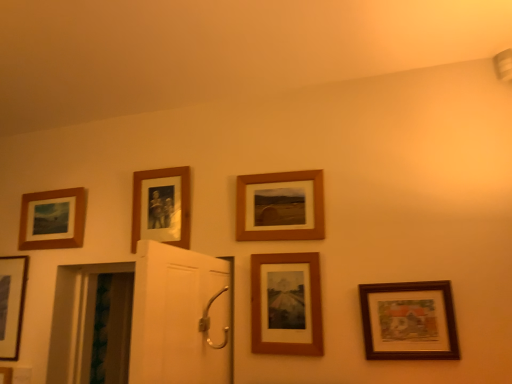
The image size is (512, 384). Describe the element at coordinates (280, 206) in the screenshot. I see `wooden frame at center, the 3th picture frame when ordered from right to left` at that location.

Find the location of a particular element. The height and width of the screenshot is (384, 512). wooden frame at center, the fourth picture frame in the left-to-right sequence is located at coordinates (280, 206).

Describe the element at coordinates (53, 219) in the screenshot. I see `matte wood picture frame at upper left, which is counted as the fifth picture frame, starting from the right` at that location.

Measure the distance between wooden photo frame at upper center, which ranks as the third picture frame in left-to-right order, and camera.

The distance of wooden photo frame at upper center, which ranks as the third picture frame in left-to-right order, from camera is 1.76 meters.

At what (x,y) coordinates should I click in order to perform the action: click on wooden picture frame at lower right, acting as the 1th picture frame starting from the right. Please return your answer as a coordinate pair (x, y). Looking at the image, I should click on (409, 321).

Is wooden picture frame at lower right, positioned as the sixth picture frame in left-to-right order, next to matte black picture frame at lower left, the 6th picture frame positioned from the right?

No, wooden picture frame at lower right, positioned as the sixth picture frame in left-to-right order, is not beside matte black picture frame at lower left, the 6th picture frame positioned from the right.

Considering the relative sizes of wooden picture frame at lower right, acting as the 1th picture frame starting from the right, and matte black picture frame at lower left, the 6th picture frame positioned from the right, in the image provided, is wooden picture frame at lower right, acting as the 1th picture frame starting from the right, thinner than matte black picture frame at lower left, the 6th picture frame positioned from the right,?

Incorrect, the width of wooden picture frame at lower right, acting as the 1th picture frame starting from the right, is not less than that of matte black picture frame at lower left, the 6th picture frame positioned from the right.

Does wooden picture frame at lower right, acting as the 1th picture frame starting from the right, contain matte black picture frame at lower left, the 1th picture frame from the left?

No, matte black picture frame at lower left, the 1th picture frame from the left, is located outside of wooden picture frame at lower right, acting as the 1th picture frame starting from the right.

From the image's perspective, is wooden picture frame at lower right, acting as the 1th picture frame starting from the right, positioned above or below matte black picture frame at lower left, the 1th picture frame from the left?

wooden picture frame at lower right, acting as the 1th picture frame starting from the right, is above matte black picture frame at lower left, the 1th picture frame from the left.

Is matte black picture frame at lower left, the 6th picture frame positioned from the right, at the left side of wooden framed print at center, placed as the second picture frame when sorted from right to left?

Correct, you'll find matte black picture frame at lower left, the 6th picture frame positioned from the right, to the left of wooden framed print at center, placed as the second picture frame when sorted from right to left.

Does matte black picture frame at lower left, the 1th picture frame from the left, have a smaller size compared to wooden framed print at center, placed as the second picture frame when sorted from right to left?

No, matte black picture frame at lower left, the 1th picture frame from the left, is not smaller than wooden framed print at center, placed as the second picture frame when sorted from right to left.

Is matte black picture frame at lower left, the 6th picture frame positioned from the right, in front of or behind wooden framed print at center, placed as the second picture frame when sorted from right to left, in the image?

Clearly, matte black picture frame at lower left, the 6th picture frame positioned from the right, is behind wooden framed print at center, placed as the second picture frame when sorted from right to left.

Does matte wood picture frame at upper left, which is the 2th picture frame in left-to-right order, appear on the left side of wooden framed print at center, which is the 5th picture frame in left-to-right order?

Correct, you'll find matte wood picture frame at upper left, which is the 2th picture frame in left-to-right order, to the left of wooden framed print at center, which is the 5th picture frame in left-to-right order.

Is point (59, 205) positioned after point (254, 264)?

That is True.

How different are the orientations of matte wood picture frame at upper left, which is the 2th picture frame in left-to-right order, and wooden framed print at center, placed as the second picture frame when sorted from right to left, in degrees?

The angle between the facing direction of matte wood picture frame at upper left, which is the 2th picture frame in left-to-right order, and the facing direction of wooden framed print at center, placed as the second picture frame when sorted from right to left, is 1.35 degrees.

Considering the sizes of objects matte wood picture frame at upper left, which is counted as the fifth picture frame, starting from the right, and wooden framed print at center, which is the 5th picture frame in left-to-right order, in the image provided, who is thinner, matte wood picture frame at upper left, which is counted as the fifth picture frame, starting from the right, or wooden framed print at center, which is the 5th picture frame in left-to-right order,?

With smaller width is wooden framed print at center, which is the 5th picture frame in left-to-right order.

Considering the relative positions of wooden picture frame at lower right, positioned as the sixth picture frame in left-to-right order, and wooden frame at center, the fourth picture frame in the left-to-right sequence, in the image provided, is wooden picture frame at lower right, positioned as the sixth picture frame in left-to-right order, in front of wooden frame at center, the fourth picture frame in the left-to-right sequence,?

That is True.

Which of these two, wooden picture frame at lower right, acting as the 1th picture frame starting from the right, or wooden frame at center, the 3th picture frame when ordered from right to left, is bigger?

wooden frame at center, the 3th picture frame when ordered from right to left.

In terms of height, does wooden picture frame at lower right, positioned as the sixth picture frame in left-to-right order, look taller or shorter compared to wooden frame at center, the fourth picture frame in the left-to-right sequence?

Clearly, wooden picture frame at lower right, positioned as the sixth picture frame in left-to-right order, is shorter compared to wooden frame at center, the fourth picture frame in the left-to-right sequence.

Is wooden picture frame at lower right, positioned as the sixth picture frame in left-to-right order, spatially inside wooden frame at center, the 3th picture frame when ordered from right to left, or outside of it?

wooden picture frame at lower right, positioned as the sixth picture frame in left-to-right order, is not enclosed by wooden frame at center, the 3th picture frame when ordered from right to left.

At what (x,y) coordinates should I click in order to perform the action: click on the 3rd picture frame above the matte black picture frame at lower left, the 6th picture frame positioned from the right (from a real-world perspective). Please return your answer as a coordinate pair (x, y). Looking at the image, I should click on (162, 206).

Measure the distance from wooden photo frame at upper center, which ranks as the third picture frame in left-to-right order, to matte black picture frame at lower left, the 6th picture frame positioned from the right.

wooden photo frame at upper center, which ranks as the third picture frame in left-to-right order, and matte black picture frame at lower left, the 6th picture frame positioned from the right, are 27.85 inches apart from each other.

Is wooden photo frame at upper center, arranged as the 4th picture frame when viewed from the right, shorter than matte black picture frame at lower left, the 6th picture frame positioned from the right?

Yes, wooden photo frame at upper center, arranged as the 4th picture frame when viewed from the right, is shorter than matte black picture frame at lower left, the 6th picture frame positioned from the right.

Does point (155, 221) lie in front of point (7, 317)?

Yes, it is.

From a real-world perspective, who is located lower, wooden framed print at center, which is the 5th picture frame in left-to-right order, or wooden photo frame at upper center, which ranks as the third picture frame in left-to-right order?

From a 3D spatial view, wooden framed print at center, which is the 5th picture frame in left-to-right order, is below.

Can you tell me how much wooden framed print at center, which is the 5th picture frame in left-to-right order, and wooden photo frame at upper center, which ranks as the third picture frame in left-to-right order, differ in facing direction?

The facing directions of wooden framed print at center, which is the 5th picture frame in left-to-right order, and wooden photo frame at upper center, which ranks as the third picture frame in left-to-right order, are 1.33 degrees apart.

Who is shorter, wooden framed print at center, which is the 5th picture frame in left-to-right order, or wooden photo frame at upper center, arranged as the 4th picture frame when viewed from the right?

Standing shorter between the two is wooden photo frame at upper center, arranged as the 4th picture frame when viewed from the right.

Where is `picture frame that is the 2nd object located behind the wooden framed print at center, which is the 5th picture frame in left-to-right order`? This screenshot has width=512, height=384. picture frame that is the 2nd object located behind the wooden framed print at center, which is the 5th picture frame in left-to-right order is located at coordinates (162, 206).

Visually, is wooden framed print at center, which is the 5th picture frame in left-to-right order, positioned to the left or to the right of matte wood picture frame at upper left, which is the 2th picture frame in left-to-right order?

Clearly, wooden framed print at center, which is the 5th picture frame in left-to-right order, is on the right of matte wood picture frame at upper left, which is the 2th picture frame in left-to-right order, in the image.

Does point (269, 279) appear closer or farther from the camera than point (24, 224)?

Point (269, 279).

From a real-world perspective, between wooden framed print at center, which is the 5th picture frame in left-to-right order, and matte wood picture frame at upper left, which is the 2th picture frame in left-to-right order, who is vertically higher?

matte wood picture frame at upper left, which is the 2th picture frame in left-to-right order, from a real-world perspective.

The image size is (512, 384). What are the coordinates of `picture frame that is the 4th object located behind the wooden framed print at center, placed as the second picture frame when sorted from right to left` in the screenshot? It's located at (53, 219).

Image resolution: width=512 pixels, height=384 pixels. In order to click on the 4th picture frame behind the wooden picture frame at lower right, positioned as the sixth picture frame in left-to-right order in this screenshot , I will do `click(11, 304)`.

Where is `the 4th picture frame to the left of the wooden framed print at center, placed as the second picture frame when sorted from right to left, starting your count from the anchor`? the 4th picture frame to the left of the wooden framed print at center, placed as the second picture frame when sorted from right to left, starting your count from the anchor is located at coordinates (11, 304).

Which object lies further to the anchor point wooden photo frame at upper center, which ranks as the third picture frame in left-to-right order, wooden framed print at center, which is the 5th picture frame in left-to-right order, or wooden frame at center, the 3th picture frame when ordered from right to left?

Based on the image, wooden framed print at center, which is the 5th picture frame in left-to-right order, appears to be further to wooden photo frame at upper center, which ranks as the third picture frame in left-to-right order.

Which object lies further to the anchor point matte black picture frame at lower left, the 6th picture frame positioned from the right, wooden frame at center, the fourth picture frame in the left-to-right sequence, or wooden picture frame at lower right, positioned as the sixth picture frame in left-to-right order?

The object further to matte black picture frame at lower left, the 6th picture frame positioned from the right, is wooden picture frame at lower right, positioned as the sixth picture frame in left-to-right order.

Estimate the real-world distances between objects in this image. Which object is further from wooden framed print at center, which is the 5th picture frame in left-to-right order, matte wood picture frame at upper left, which is the 2th picture frame in left-to-right order, or wooden picture frame at lower right, positioned as the sixth picture frame in left-to-right order?

The object further to wooden framed print at center, which is the 5th picture frame in left-to-right order, is matte wood picture frame at upper left, which is the 2th picture frame in left-to-right order.

Estimate the real-world distances between objects in this image. Which object is closer to wooden frame at center, the fourth picture frame in the left-to-right sequence, wooden framed print at center, placed as the second picture frame when sorted from right to left, or matte wood picture frame at upper left, which is the 2th picture frame in left-to-right order?

wooden framed print at center, placed as the second picture frame when sorted from right to left, lies closer to wooden frame at center, the fourth picture frame in the left-to-right sequence, than the other object.

When comparing their distances from wooden frame at center, the fourth picture frame in the left-to-right sequence, does matte black picture frame at lower left, the 6th picture frame positioned from the right, or matte wood picture frame at upper left, which is counted as the fifth picture frame, starting from the right, seem further?

matte black picture frame at lower left, the 6th picture frame positioned from the right, is positioned further to the anchor wooden frame at center, the fourth picture frame in the left-to-right sequence.

Estimate the real-world distances between objects in this image. Which object is closer to wooden framed print at center, which is the 5th picture frame in left-to-right order, wooden photo frame at upper center, which ranks as the third picture frame in left-to-right order, or matte black picture frame at lower left, the 1th picture frame from the left?

wooden photo frame at upper center, which ranks as the third picture frame in left-to-right order, lies closer to wooden framed print at center, which is the 5th picture frame in left-to-right order, than the other object.

Considering their positions, is matte black picture frame at lower left, the 1th picture frame from the left, positioned closer to wooden photo frame at upper center, which ranks as the third picture frame in left-to-right order, than wooden picture frame at lower right, acting as the 1th picture frame starting from the right?

Among the two, matte black picture frame at lower left, the 1th picture frame from the left, is located nearer to wooden photo frame at upper center, which ranks as the third picture frame in left-to-right order.

Considering their positions, is wooden frame at center, the fourth picture frame in the left-to-right sequence, positioned closer to wooden picture frame at lower right, acting as the 1th picture frame starting from the right, than matte black picture frame at lower left, the 6th picture frame positioned from the right?

wooden frame at center, the fourth picture frame in the left-to-right sequence, is positioned closer to the anchor wooden picture frame at lower right, acting as the 1th picture frame starting from the right.

The image size is (512, 384). I want to click on picture frame located between wooden frame at center, the fourth picture frame in the left-to-right sequence, and wooden picture frame at lower right, acting as the 1th picture frame starting from the right, in the left-right direction, so click(x=286, y=304).

The width and height of the screenshot is (512, 384). I want to click on picture frame located between matte black picture frame at lower left, the 6th picture frame positioned from the right, and wooden photo frame at upper center, arranged as the 4th picture frame when viewed from the right, in the left-right direction, so click(53, 219).

This screenshot has height=384, width=512. I want to click on picture frame between matte wood picture frame at upper left, which is counted as the fifth picture frame, starting from the right, and wooden frame at center, the 3th picture frame when ordered from right to left, from left to right, so click(x=162, y=206).

Locate an element on the screen. picture frame located between wooden photo frame at upper center, arranged as the 4th picture frame when viewed from the right, and wooden framed print at center, placed as the second picture frame when sorted from right to left, in the left-right direction is located at coordinates (280, 206).